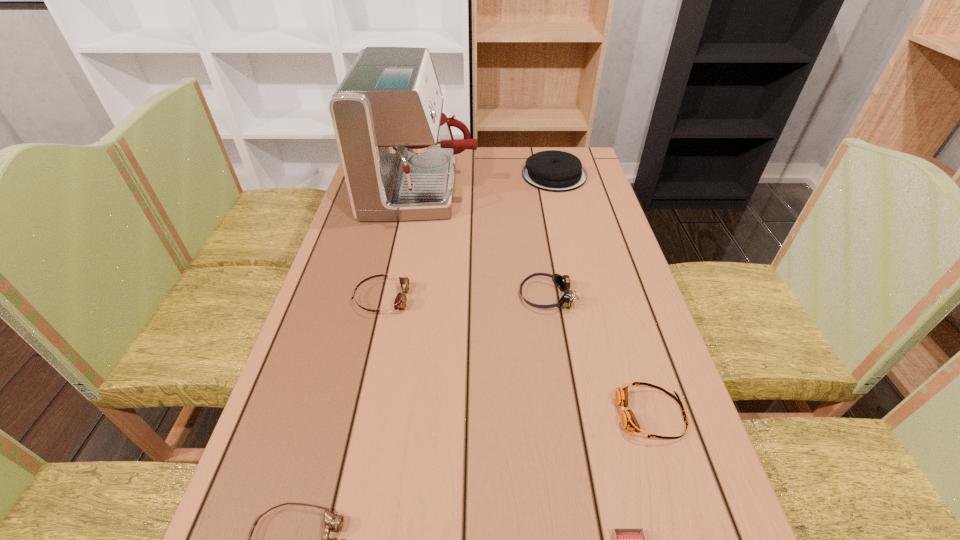
Where is `object situated at the far left corner`? The width and height of the screenshot is (960, 540). object situated at the far left corner is located at coordinates (397, 150).

Image resolution: width=960 pixels, height=540 pixels. Find the location of `object that is at the far right corner`. object that is at the far right corner is located at coordinates (555, 171).

The width and height of the screenshot is (960, 540). What are the coordinates of `free space at the far edge of the desktop` in the screenshot? It's located at (469, 154).

Identify the location of free space at the left edge of the desktop. (352, 234).

The width and height of the screenshot is (960, 540). Find the location of `vacant region at the right edge`. vacant region at the right edge is located at coordinates pyautogui.click(x=601, y=225).

Locate an element on the screen. Image resolution: width=960 pixels, height=540 pixels. vacant space at the far right corner of the desktop is located at coordinates (585, 168).

You are a GUI agent. You are given a task and a screenshot of the screen. Output one action in this format:
    pyautogui.click(x=<x>, y=<y>)
    Task: Click on the free point between the rightmost goggles and the tallest object
    The width and height of the screenshot is (960, 540).
    Given the screenshot: What is the action you would take?
    pyautogui.click(x=537, y=302)

You are a GUI agent. You are given a task and a screenshot of the screen. Output one action in this format:
    pyautogui.click(x=<x>, y=<y>)
    Task: Click on the free space between the rightmost goggles and the pancake
    
    Given the screenshot: What is the action you would take?
    pyautogui.click(x=603, y=295)

I want to click on free space between the sixth shortest object and the third goggles from left to right, so click(x=550, y=235).

Find the location of a particular element. The width and height of the screenshot is (960, 540). the fourth closest object to the sixth shortest object is located at coordinates (628, 421).